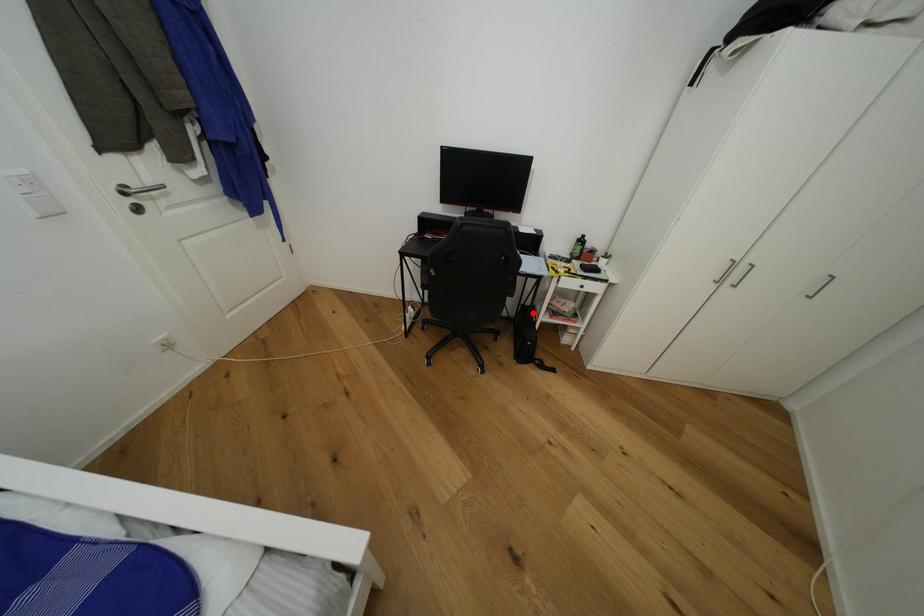
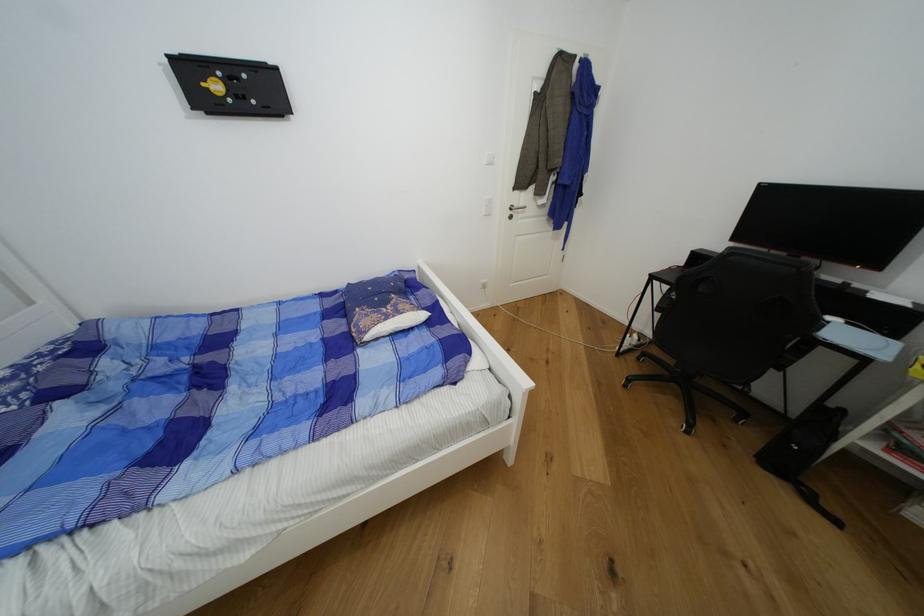
Question: I am providing you with two images of the same scene from different viewpoints. In image1, a red point is highlighted. Considering the same 3D point in image2, which of the following is correct?

Choices:
 (A) It is closer
 (B) It is farther

Answer: (B)